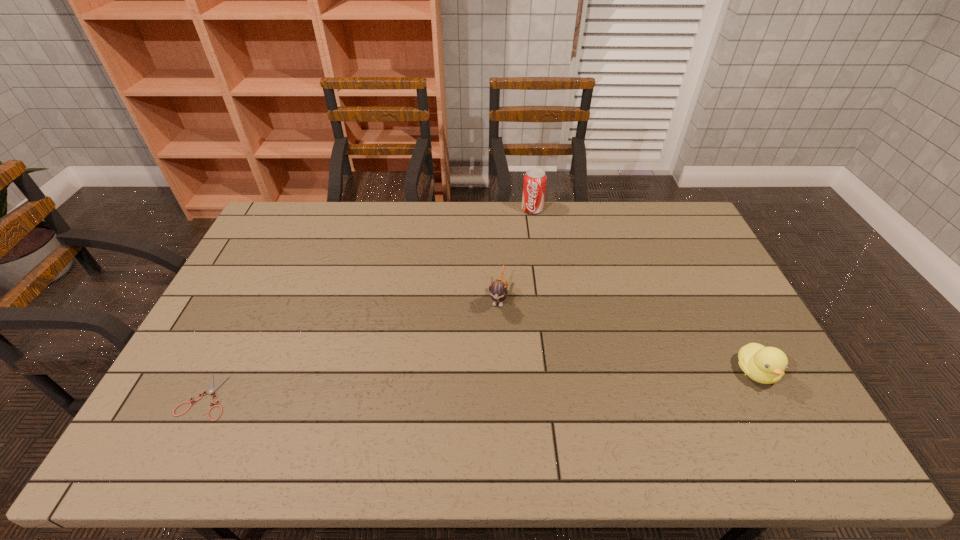
The width and height of the screenshot is (960, 540). What are the coordinates of `object that is at the near left corner` in the screenshot? It's located at (211, 389).

Locate an element on the screen. object that is at the near right corner is located at coordinates 766,365.

The height and width of the screenshot is (540, 960). In the image, there is a desktop. What are the coordinates of `free region at the far edge` in the screenshot? It's located at (585, 217).

Locate an element on the screen. This screenshot has width=960, height=540. vacant space at the near edge is located at coordinates (475, 406).

At what (x,y) coordinates should I click in order to perform the action: click on vacant space at the left edge of the desktop. Please return your answer as a coordinate pair (x, y). This screenshot has width=960, height=540. Looking at the image, I should click on (236, 348).

At what (x,y) coordinates should I click in order to perform the action: click on free region at the right edge. Please return your answer as a coordinate pair (x, y). Looking at the image, I should click on (708, 280).

This screenshot has height=540, width=960. In the image, there is a desktop. Find the location of `vacant space at the far left corner`. vacant space at the far left corner is located at coordinates (280, 208).

Find the location of a particular element. The width and height of the screenshot is (960, 540). vacant space at the far right corner of the desktop is located at coordinates (654, 221).

Locate an element on the screen. The image size is (960, 540). vacant space in between the farthest object and the kitten is located at coordinates (516, 253).

The height and width of the screenshot is (540, 960). What are the coordinates of `blank region between the third nearest object and the second object from right to left` in the screenshot? It's located at (516, 253).